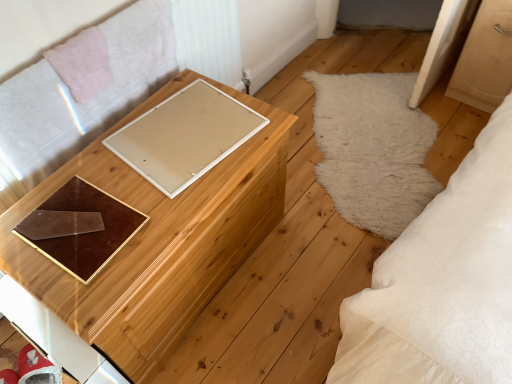
In order to click on free location in front of brown glossy tray at center in this screenshot , I will do `click(75, 284)`.